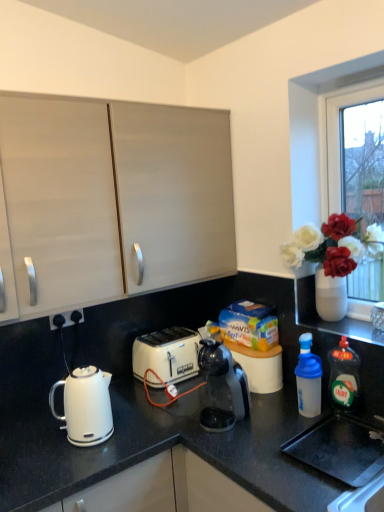
Locate an element on the screen. Image resolution: width=384 pixels, height=512 pixels. vacant area to the left of white glossy kettle at left is located at coordinates (36, 432).